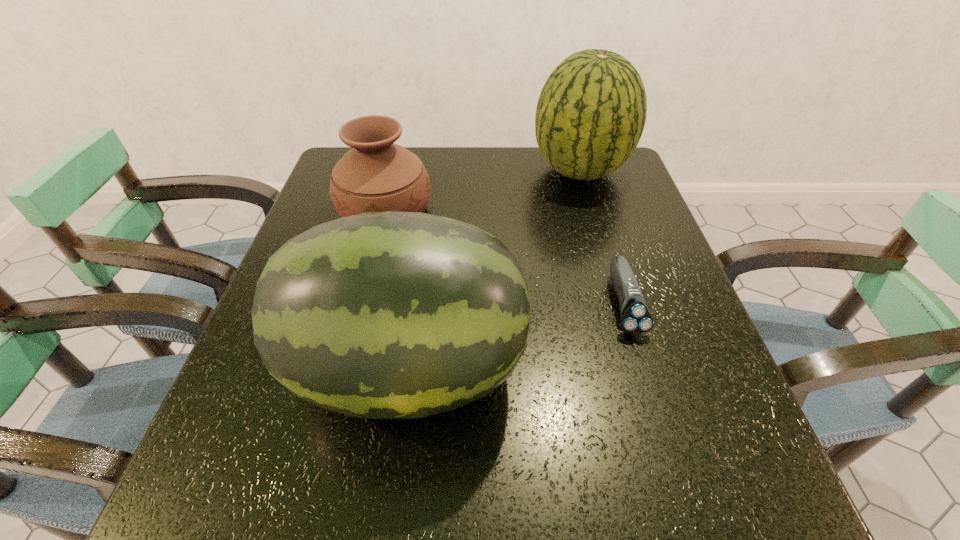
The width and height of the screenshot is (960, 540). In order to click on the farther watermelon in this screenshot , I will do `click(591, 112)`.

Find the location of `the left watermelon`. the left watermelon is located at coordinates (383, 315).

Where is `urn`? This screenshot has height=540, width=960. urn is located at coordinates (376, 175).

In order to click on electric shaver in this screenshot , I will do `click(635, 318)`.

The height and width of the screenshot is (540, 960). I want to click on free space located 0.310m on the left of the farther watermelon, so click(x=420, y=171).

Find the location of a particular element. vacant region located 0.100m on the right of the left watermelon is located at coordinates (581, 369).

Find the location of `free spot located on the left of the urn`. free spot located on the left of the urn is located at coordinates (318, 211).

Image resolution: width=960 pixels, height=540 pixels. I want to click on free space located 0.150m on the head of the shortest object, so click(658, 415).

I want to click on watermelon at the far edge, so click(591, 112).

What are the coordinates of `urn situated at the far edge` in the screenshot? It's located at (376, 175).